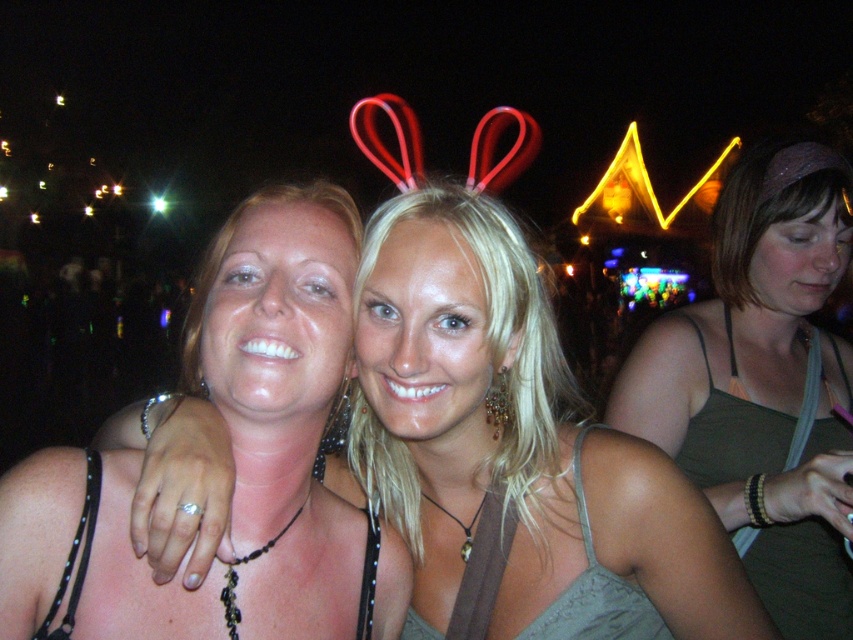
Question: Does matte black tank top at center have a lesser width compared to matte green tank top at center?

Choices:
 (A) yes
 (B) no

Answer: (B)

Question: Which of the following is the farthest from the observer?

Choices:
 (A) matte green tank top at center
 (B) matte black tank top at center

Answer: (A)

Question: Among these objects, which one is farthest from the camera?

Choices:
 (A) matte green tank top at center
 (B) matte black tank top at center

Answer: (A)

Question: Is matte black tank top at center positioned behind matte green tank top at center?

Choices:
 (A) yes
 (B) no

Answer: (B)

Question: Does matte black tank top at center appear on the right side of matte green tank top at center?

Choices:
 (A) no
 (B) yes

Answer: (A)

Question: Among these objects, which one is nearest to the camera?

Choices:
 (A) matte green tank top at center
 (B) matte black tank top at center

Answer: (B)